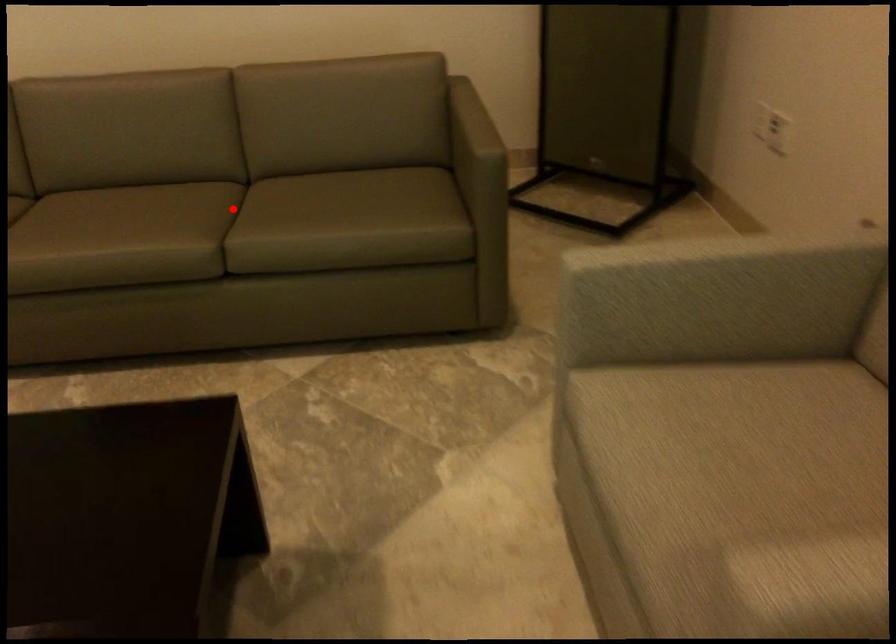
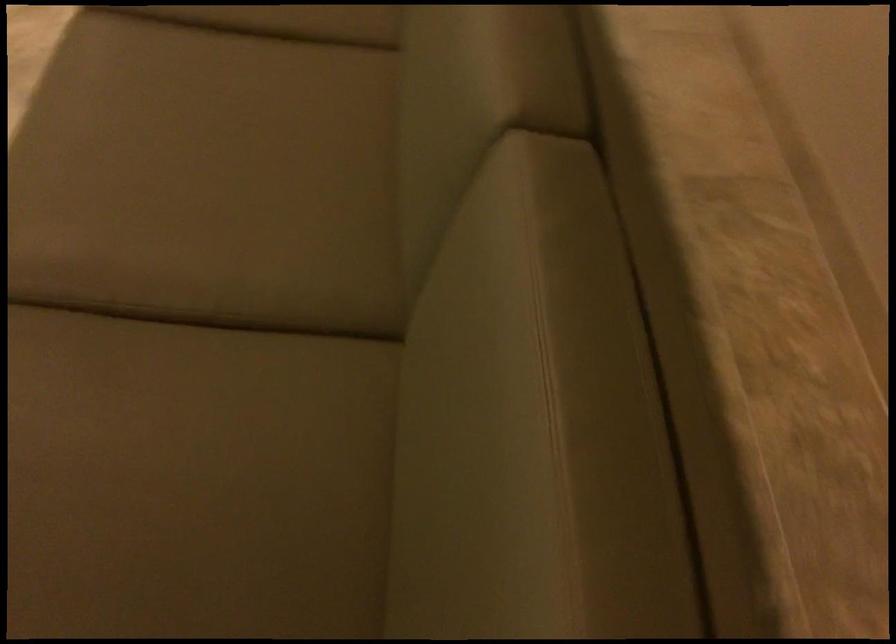
The point at the highlighted location is marked in the first image. Where is the corresponding point in the second image?

(211, 339)